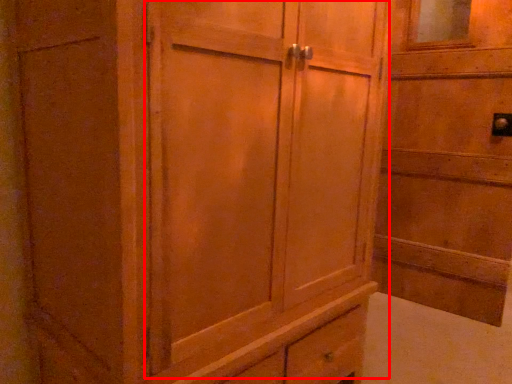
Question: Where is barn door (annotated by the red box) located in relation to elevator in the image?

Choices:
 (A) right
 (B) left

Answer: (B)